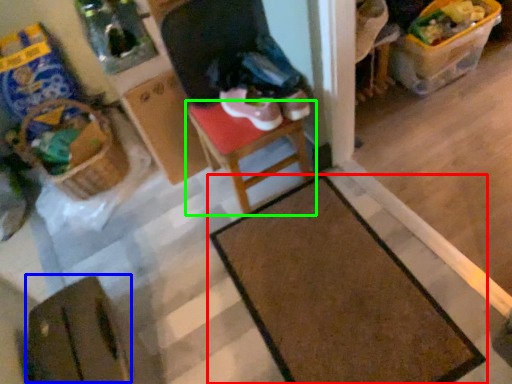
Question: Considering the real-world distances, which object is farthest from table (highlighted by a red box)? wide (highlighted by a blue box) or furniture (highlighted by a green box)?

Choices:
 (A) wide
 (B) furniture

Answer: (A)